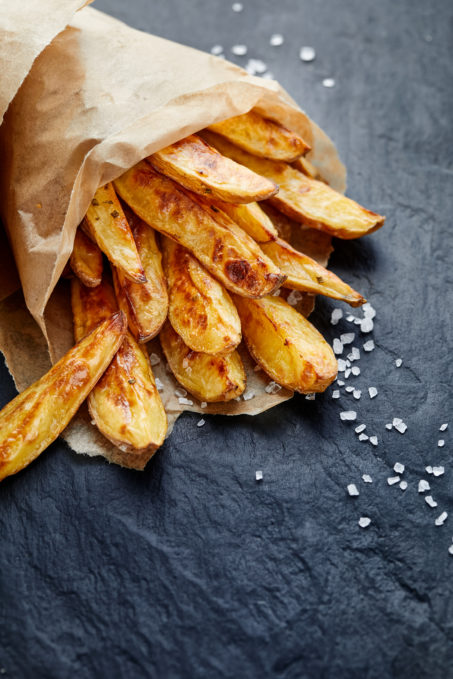
This screenshot has height=679, width=453. I want to click on surface, so click(373, 88).